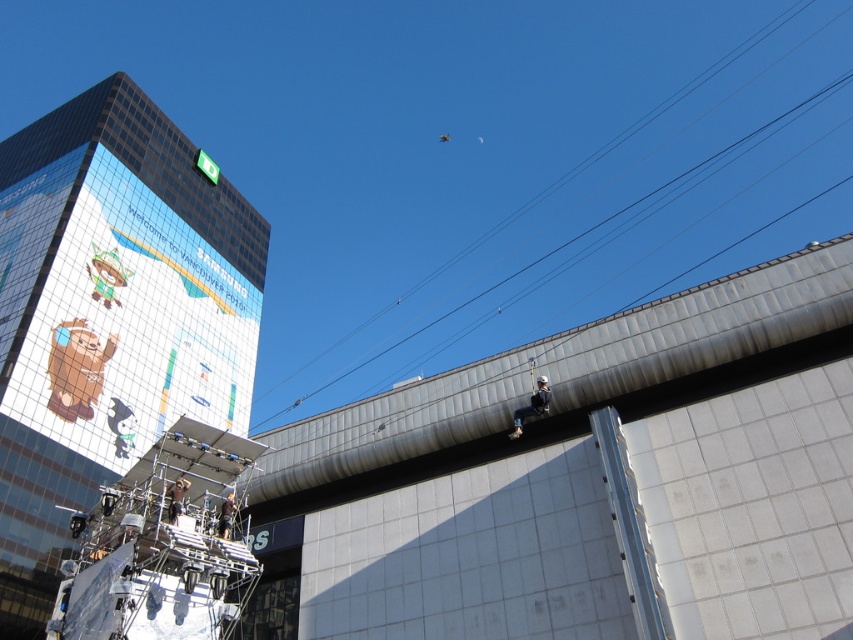
You are a construction worker standing on the scaffolding and looking up. You need to install a new safety net between the reflective glass billboard at upper left and the black wire at upper center. Can you place the net above the billboard without it touching the wire?

The reflective glass billboard at upper left is positioned under the black wire at upper center, so placing the safety net above the billboard would mean it is below the wire. Therefore, the net can be installed without touching the wire as long as it stays between them.

You are a construction worker standing on the scaffolding and need to reach the reflective glass billboard at upper left and the black wire at upper center. Which object is closer to your current position on the scaffolding?

The reflective glass billboard at upper left is closer to your current position on the scaffolding because it is to the left of the black wire at upper center, meaning it is positioned nearer in the horizontal plane.